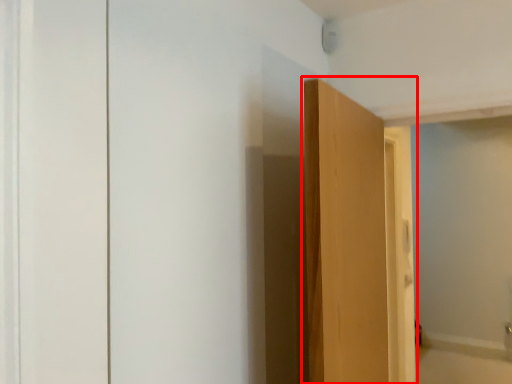
Question: From the image's perspective, what is the correct spatial relationship of door (annotated by the red box) in relation to bath?

Choices:
 (A) below
 (B) above

Answer: (B)